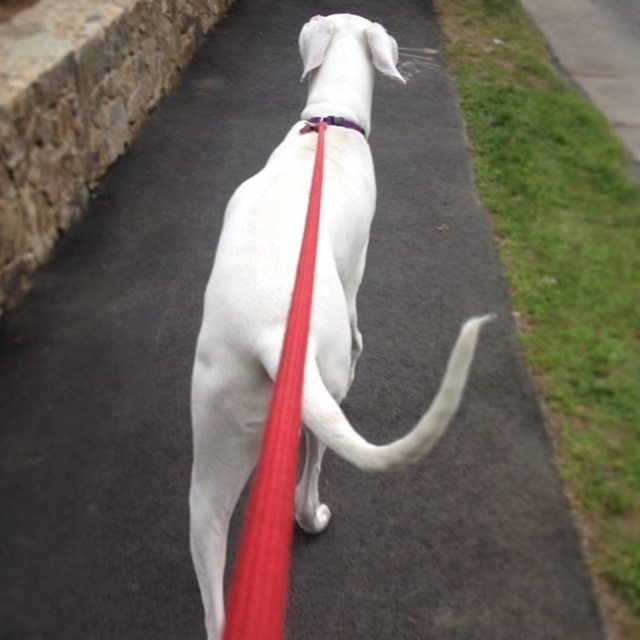
Who is shorter, grassy sidewalk at right or purple fabric neckband at center?

Standing shorter between the two is purple fabric neckband at center.

This screenshot has width=640, height=640. I want to click on grassy sidewalk at right, so click(x=596, y=56).

Is point (614, 3) positioned in front of point (352, 128)?

No, (614, 3) is behind (352, 128).

Find the location of a particular element. The width and height of the screenshot is (640, 640). grassy sidewalk at right is located at coordinates (596, 56).

Is white smooth dog at center above purple fabric neckband at center?

Actually, white smooth dog at center is below purple fabric neckband at center.

Can you confirm if white smooth dog at center is positioned to the right of purple fabric neckband at center?

Indeed, white smooth dog at center is positioned on the right side of purple fabric neckband at center.

The image size is (640, 640). What do you see at coordinates (289, 301) in the screenshot? I see `white smooth dog at center` at bounding box center [289, 301].

Locate an element on the screen. Image resolution: width=640 pixels, height=640 pixels. white smooth dog at center is located at coordinates (289, 301).

Which is behind, point (260, 433) or point (314, 202)?

Positioned behind is point (314, 202).

Which is more to the right, white smooth dog at center or red rubber leash at center?

white smooth dog at center is more to the right.

Identify the location of white smooth dog at center. (289, 301).